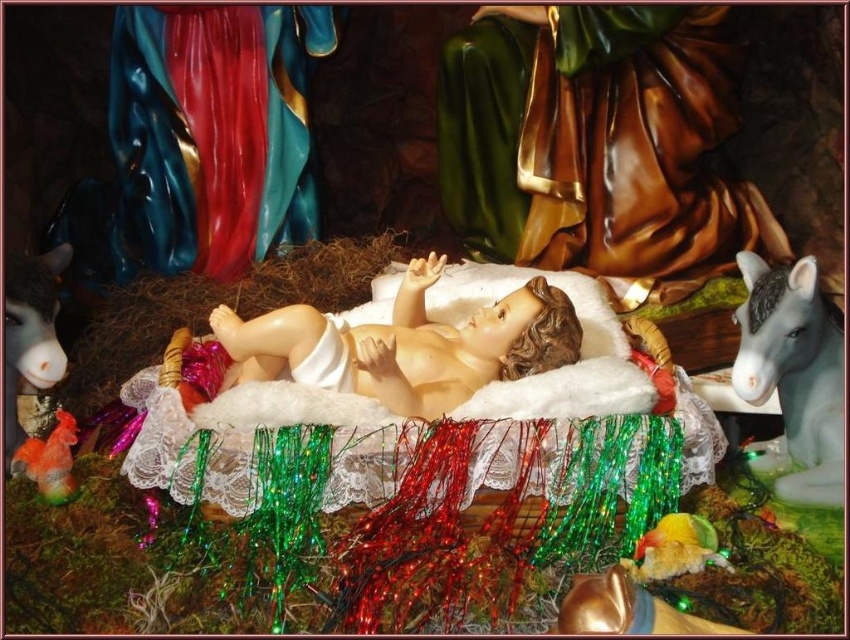
Is point (12, 285) positioned after point (624, 564)?

Yes, point (12, 285) is behind point (624, 564).

Does point (4, 410) come closer to viewer compared to point (700, 563)?

No, (4, 410) is behind (700, 563).

This screenshot has height=640, width=850. What do you see at coordinates (30, 332) in the screenshot?
I see `brown fur stuffed animal at left` at bounding box center [30, 332].

The image size is (850, 640). I want to click on brown fur stuffed animal at left, so (30, 332).

Who is positioned more to the left, white glossy horse at right or brown fur stuffed animal at left?

Positioned to the left is brown fur stuffed animal at left.

This screenshot has height=640, width=850. What do you see at coordinates (794, 374) in the screenshot? I see `white glossy horse at right` at bounding box center [794, 374].

The image size is (850, 640). In order to click on white glossy horse at right in this screenshot , I will do `click(794, 374)`.

Which of these two, white glossy horse at right or multicolored plastic parrot at lower right, stands taller?

white glossy horse at right is taller.

Does white glossy horse at right appear over multicolored plastic parrot at lower right?

Correct, white glossy horse at right is located above multicolored plastic parrot at lower right.

Locate an element on the screen. The width and height of the screenshot is (850, 640). white glossy horse at right is located at coordinates (794, 374).